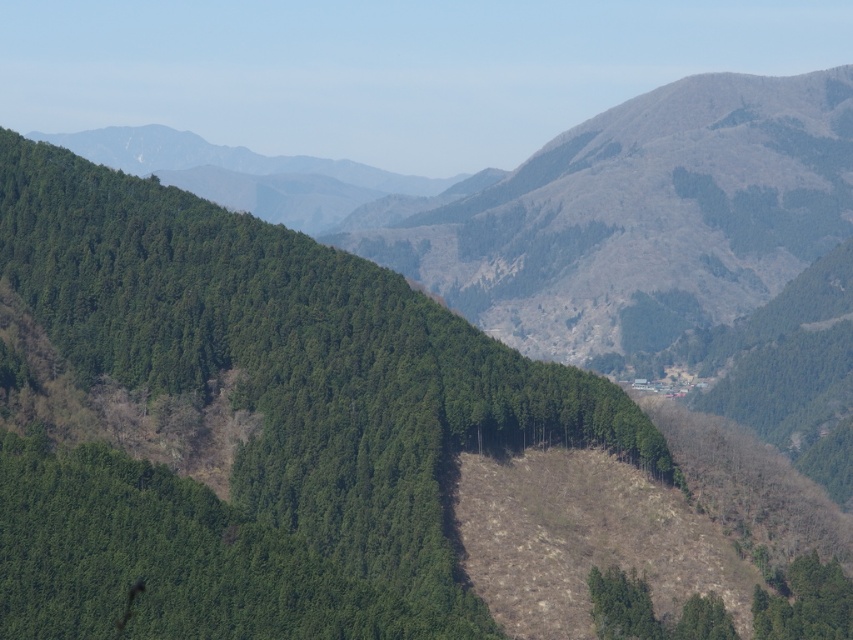
In the scene shown: Who is higher up, green textured forest at center or green matte tree at lower right?

green textured forest at center is higher up.

Between green textured forest at center and green matte tree at lower right, which one appears on the left side from the viewer's perspective?

Positioned to the left is green textured forest at center.

Where is `green textured forest at center`? This screenshot has width=853, height=640. green textured forest at center is located at coordinates (263, 420).